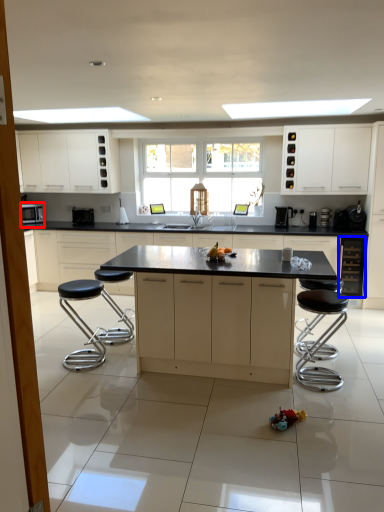
Question: Among these objects, which one is nearest to the camera, appliance (highlighted by a red box) or cabinetry (highlighted by a blue box)?

Choices:
 (A) appliance
 (B) cabinetry

Answer: (B)